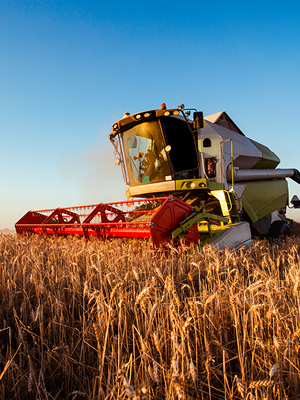
At what (x,y) coordinates should I click in order to perform the action: click on lights. Please return your answer as a coordinate pair (x, y). Looking at the image, I should click on point(137,116), point(147,113), point(166,114), point(176,112), point(116,125), point(168,147), point(118,160).